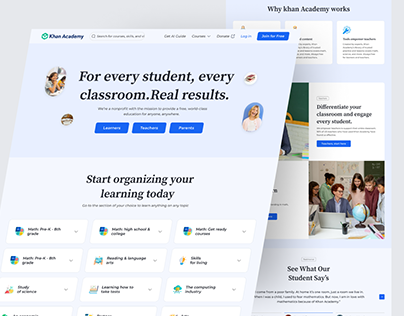
Image resolution: width=404 pixels, height=316 pixels. What are the coordinates of `globe` in the screenshot? It's located at (356, 212).